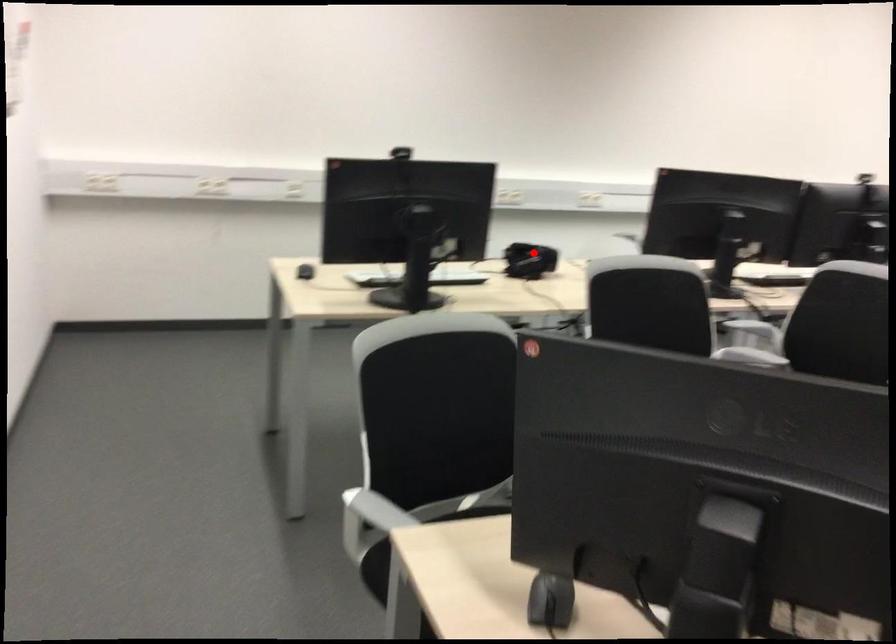
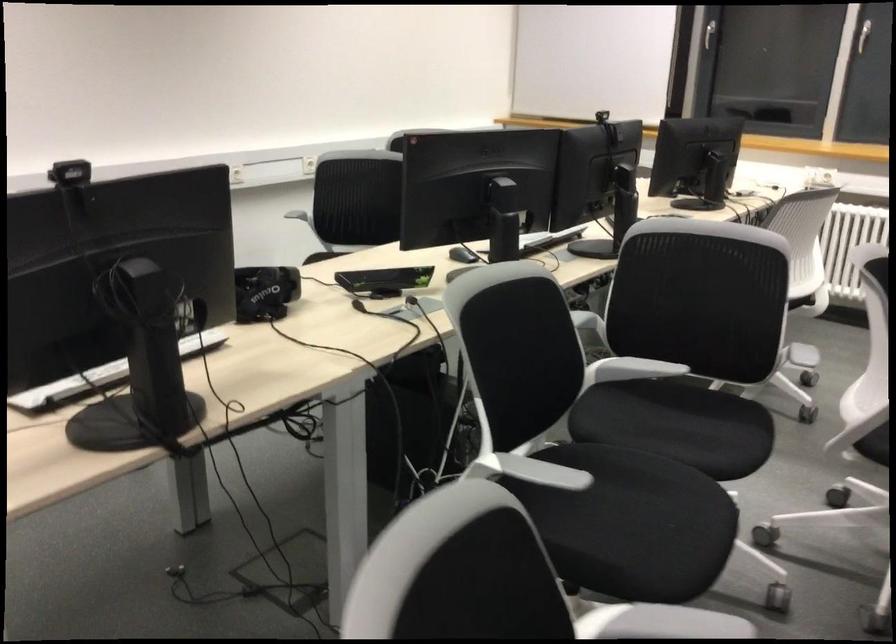
Find the pixel in the second image that matches the highlighted location in the first image.

(264, 292)